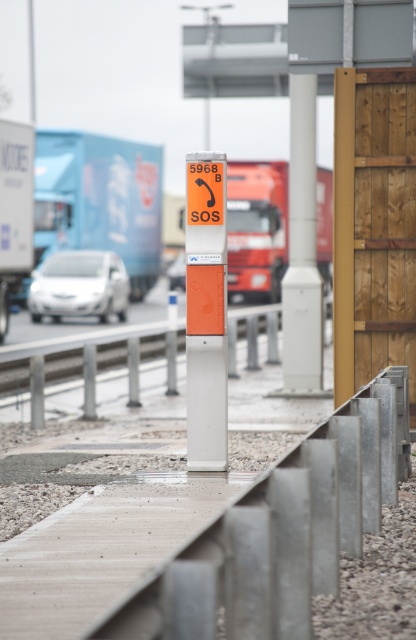
You are driving a delivery van that is 12 feet long. You want to park between the blue matte trailer truck at left and the matte white car at center. Is there enough space to park your van there?

The blue matte trailer truck at left and the matte white car at center are 31.76 feet apart. Since your van is 12 feet long, there is sufficient space to park between them as the distance between the two vehicles is greater than the van length.

You are a delivery driver who needs to report an accident using the emergency call system. The system is located at coordinates 0.5, 0.5. Can you reach the system from your current position at the blue matte trailer truck at left without crossing any guardrails?

Answer: The blue matte trailer truck at left is located at point (99, 198), while the emergency call system is at (208, 320). Since the guardrails are parallel to the road and spaced evenly, there is a clear path between the two points. Therefore, you can reach the system without crossing any guardrails.

You are a pedestrian standing at the roadside emergency call system. You see a blue matte trailer truck at left and a matte white car at center. Which vehicle is closer to the emergency call system post?

The blue matte trailer truck at left is closer to the emergency call system post because it is positioned over the matte white car at center, indicating it is in front of the car and thus nearer to the post.